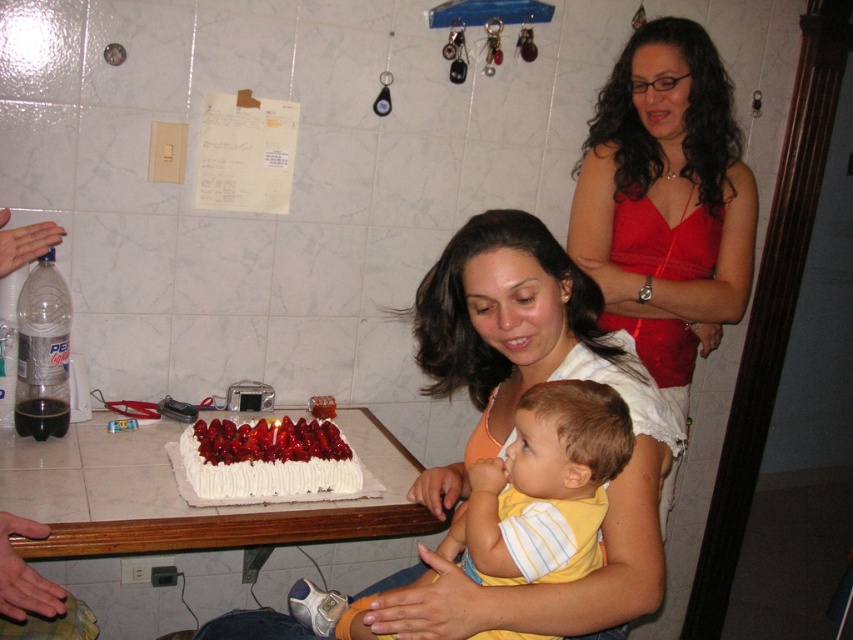
Who is lower down, white wood table at lower left or white cream cake with strawberries at center?

Positioned lower is white wood table at lower left.

You are a GUI agent. You are given a task and a screenshot of the screen. Output one action in this format:
    pyautogui.click(x=<x>, y=<y>)
    Task: Click on the white wood table at lower left
    This screenshot has height=640, width=853.
    Given the screenshot: What is the action you would take?
    pyautogui.click(x=181, y=499)

The image size is (853, 640). In order to click on white wood table at lower left in this screenshot , I will do [x=181, y=499].

In the scene shown: Does matte red dress at upper right have a smaller size compared to white cream cake with strawberries at center?

Incorrect, matte red dress at upper right is not smaller in size than white cream cake with strawberries at center.

The height and width of the screenshot is (640, 853). I want to click on matte red dress at upper right, so click(x=666, y=202).

Locate an element on the screen. matte red dress at upper right is located at coordinates (666, 202).

Which is more to the left, matte red dress at upper right or white wood table at lower left?

white wood table at lower left

The height and width of the screenshot is (640, 853). What do you see at coordinates (666, 202) in the screenshot?
I see `matte red dress at upper right` at bounding box center [666, 202].

Is point (630, 298) behind point (404, 531)?

That is True.

Where is `matte red dress at upper right`? Image resolution: width=853 pixels, height=640 pixels. matte red dress at upper right is located at coordinates (666, 202).